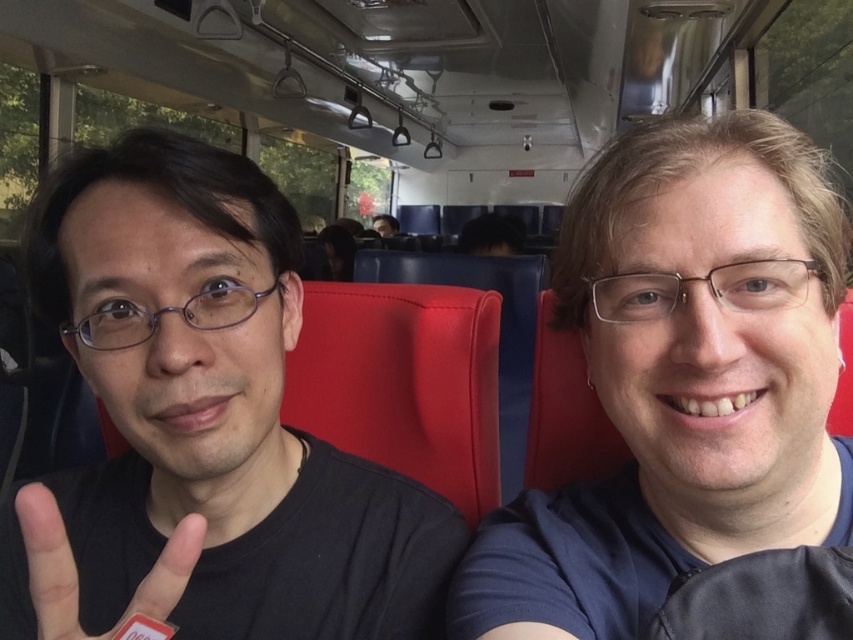
Question: Which of these objects is positioned closest to the black matte shirt at left?

Choices:
 (A) dark brown hair at upper center
 (B) blue fabric shirt at right

Answer: (B)

Question: Does black matte hand at left appear over dark brown hair at upper center?

Choices:
 (A) yes
 (B) no

Answer: (B)

Question: Does black matte shirt at left come behind dark brown hair at upper center?

Choices:
 (A) no
 (B) yes

Answer: (A)

Question: Which object is closer to the camera taking this photo?

Choices:
 (A) blue fabric shirt at right
 (B) black matte shirt at left

Answer: (B)

Question: Considering the relative positions of black matte hand at left and dark brown hair at upper center in the image provided, where is black matte hand at left located with respect to dark brown hair at upper center?

Choices:
 (A) below
 (B) above

Answer: (A)

Question: Which is nearer to the dark brown hair at upper center?

Choices:
 (A) black matte hand at left
 (B) black matte shirt at left
 (C) blue fabric shirt at right

Answer: (B)